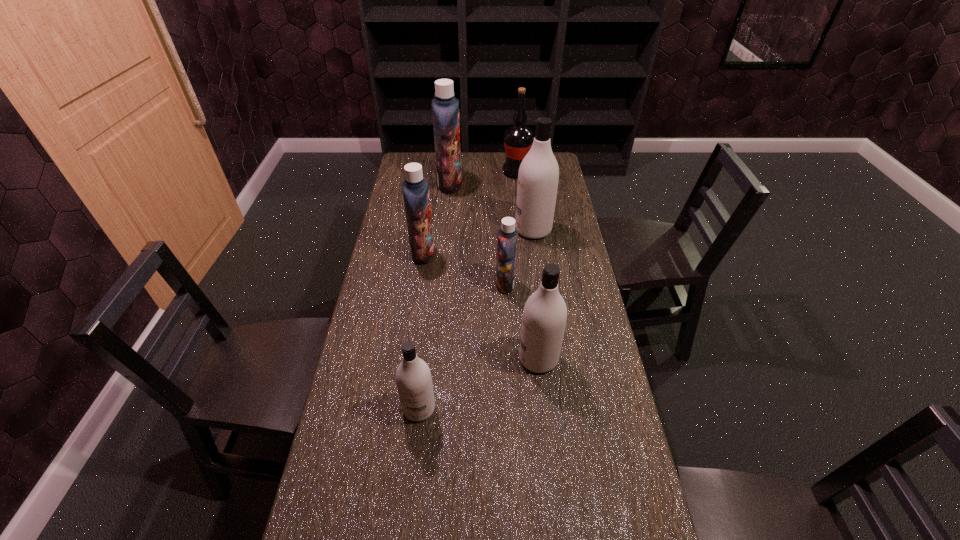
Find the location of a particular element. Image resolution: width=960 pixels, height=540 pixels. vacant space located on the front label of the rightmost blue shampoo is located at coordinates (395, 284).

Identify the location of vacant space located 0.250m on the front label of the rightmost blue shampoo. (423, 284).

The height and width of the screenshot is (540, 960). Identify the location of vacant region located 0.130m on the front label of the rightmost blue shampoo. [458, 284].

At what (x,y) coordinates should I click in order to perform the action: click on blank space located on the front-facing side of the leftmost white shampoo. Please return your answer as a coordinate pair (x, y). The image size is (960, 540). Looking at the image, I should click on (405, 539).

Where is `shampoo present at the far edge`? Image resolution: width=960 pixels, height=540 pixels. shampoo present at the far edge is located at coordinates (445, 107).

The width and height of the screenshot is (960, 540). Find the location of `wine bottle situated at the far edge`. wine bottle situated at the far edge is located at coordinates (518, 139).

This screenshot has width=960, height=540. I want to click on object located at the left edge, so click(x=415, y=188).

You are a GUI agent. You are given a task and a screenshot of the screen. Output one action in this format:
    pyautogui.click(x=<x>, y=<y>)
    Task: Click on the wine bottle at the right edge
    The width and height of the screenshot is (960, 540).
    Given the screenshot: What is the action you would take?
    pyautogui.click(x=518, y=139)

Where is `object situated at the far right corner`? Image resolution: width=960 pixels, height=540 pixels. object situated at the far right corner is located at coordinates (518, 139).

The height and width of the screenshot is (540, 960). What are the coordinates of `vacant space at the far edge of the desktop` in the screenshot? It's located at (499, 176).